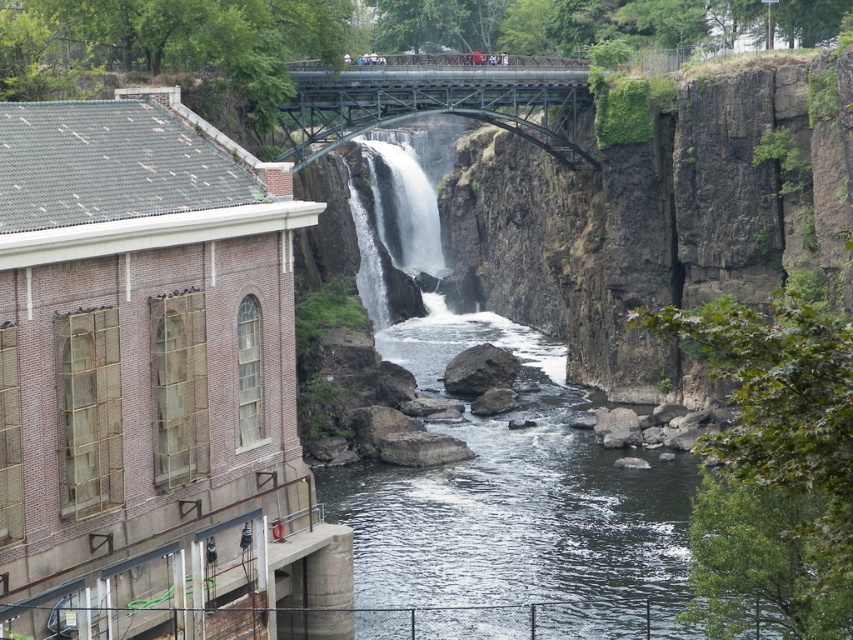
Question: Can you confirm if metallic bridge at upper center is positioned to the left of white frothy water at center?

Choices:
 (A) no
 (B) yes

Answer: (A)

Question: Based on their relative distances, which object is nearer to the white frothy water at center?

Choices:
 (A) clear water at center
 (B) metallic bridge at upper center

Answer: (A)

Question: Does clear water at center appear under metallic bridge at upper center?

Choices:
 (A) yes
 (B) no

Answer: (A)

Question: Which point is closer to the camera?

Choices:
 (A) clear water at center
 (B) white frothy water at center

Answer: (A)

Question: Which of the following is the farthest from the observer?

Choices:
 (A) white frothy water at center
 (B) metallic bridge at upper center
 (C) clear water at center

Answer: (A)

Question: Can you confirm if clear water at center is positioned to the right of white frothy water at center?

Choices:
 (A) no
 (B) yes

Answer: (B)